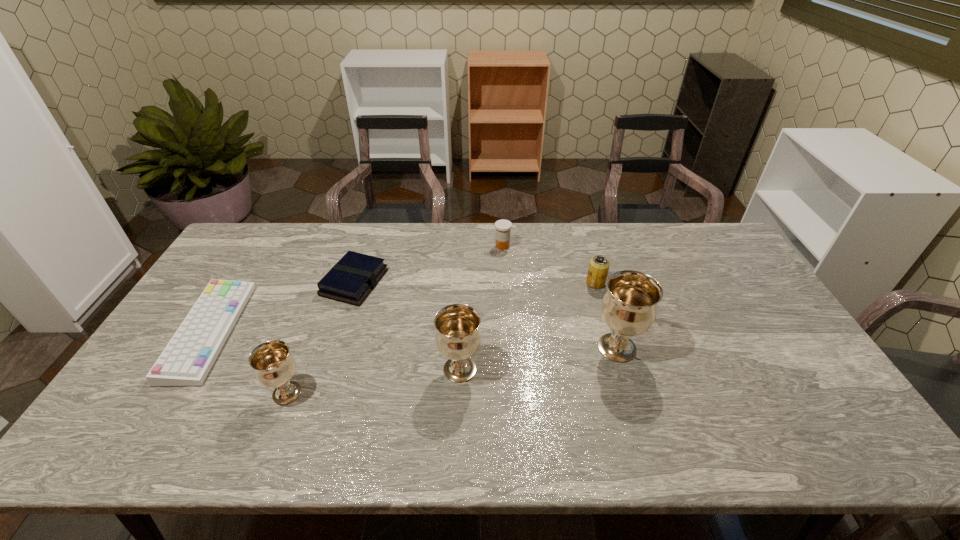
I want to click on computer keyboard, so click(x=187, y=359).

You are a GUI agent. You are given a task and a screenshot of the screen. Output one action in this format:
    pyautogui.click(x=<x>, y=<y>)
    Task: Click on the vacant space located 0.250m on the back of the leftmost chalice
    This screenshot has width=960, height=540.
    Given the screenshot: What is the action you would take?
    pyautogui.click(x=319, y=310)

At what (x,y) coordinates should I click in order to perform the action: click on free point located 0.060m on the front of the fourth object from right to left. Please return your answer as a coordinate pair (x, y). This screenshot has width=960, height=540. Looking at the image, I should click on (458, 408).

Where is `vacant space located 0.340m on the left of the tallest object`? The image size is (960, 540). vacant space located 0.340m on the left of the tallest object is located at coordinates (469, 348).

Locate an element on the screen. The height and width of the screenshot is (540, 960). free location located on the right of the book is located at coordinates click(x=510, y=282).

Find the location of a particular element. The width and height of the screenshot is (960, 540). vacant point located on the label of the fifth object from left to right is located at coordinates (471, 246).

Locate an element on the screen. blank space located 0.050m on the label of the fifth object from left to right is located at coordinates (480, 246).

Image resolution: width=960 pixels, height=540 pixels. Identify the location of free spot located 0.380m on the label of the fifth object from left to right. (388, 246).

Identify the location of vacant space situated 0.390m on the front of the beer can. The width and height of the screenshot is (960, 540). (629, 395).

I want to click on vacant space situated on the right of the computer keyboard, so click(286, 332).